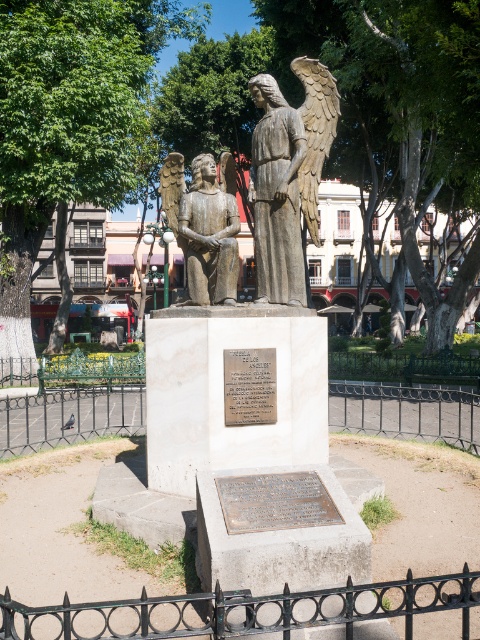
Does black wrought iron fence at lower center lie in front of bronze statue at center?

Yes.

Which is more to the right, black wrought iron fence at lower center or bronze statue at center?

black wrought iron fence at lower center

Where is `black wrought iron fence at lower center`? black wrought iron fence at lower center is located at coordinates (241, 611).

You are a GUI agent. You are given a task and a screenshot of the screen. Output one action in this format:
    pyautogui.click(x=<x>, y=<y>)
    Task: Click on the black wrought iron fence at lower center
    The width and height of the screenshot is (480, 640).
    Given the screenshot: What is the action you would take?
    pyautogui.click(x=241, y=611)

Does black wrought iron fence at center have a greater height compared to bronze statue of an angel at center?

In fact, black wrought iron fence at center may be shorter than bronze statue of an angel at center.

Based on the photo, between black wrought iron fence at center and bronze statue of an angel at center, which one has more height?

Standing taller between the two is bronze statue of an angel at center.

Who is more forward, (60, 435) or (309, 193)?

Point (309, 193) is in front.

The image size is (480, 640). Find the location of `black wrought iron fence at center`. black wrought iron fence at center is located at coordinates (407, 410).

Is black wrought iron fence at lower center smaller than black wrought iron fence at center?

Yes.

Is point (197, 605) closer to camera compared to point (34, 442)?

That is True.

Where is `black wrought iron fence at lower center`? black wrought iron fence at lower center is located at coordinates (241, 611).

Find the location of a particular element. This screenshot has height=640, width=480. black wrought iron fence at lower center is located at coordinates (241, 611).